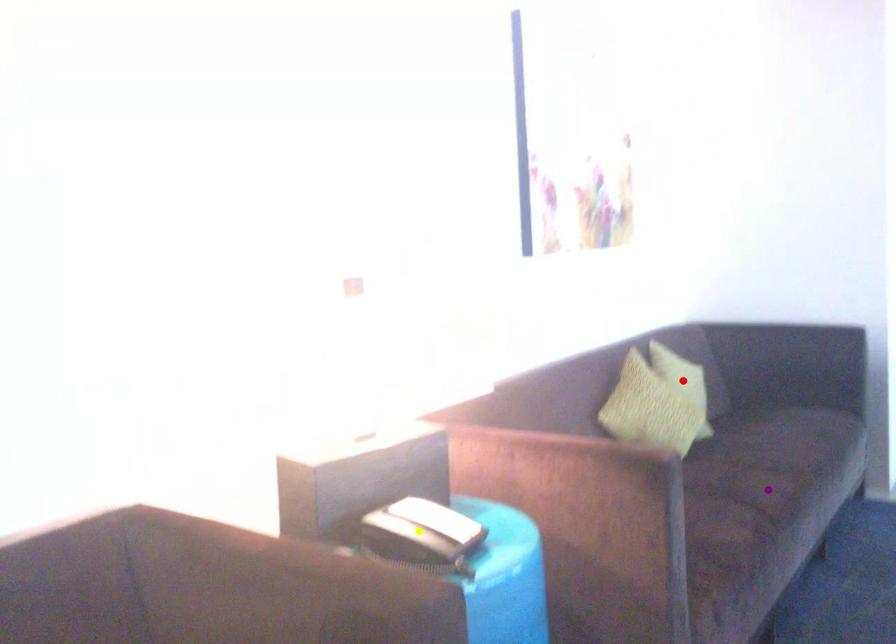
Order these from nearest to farthest:
1. purple point
2. red point
3. yellow point

1. yellow point
2. purple point
3. red point